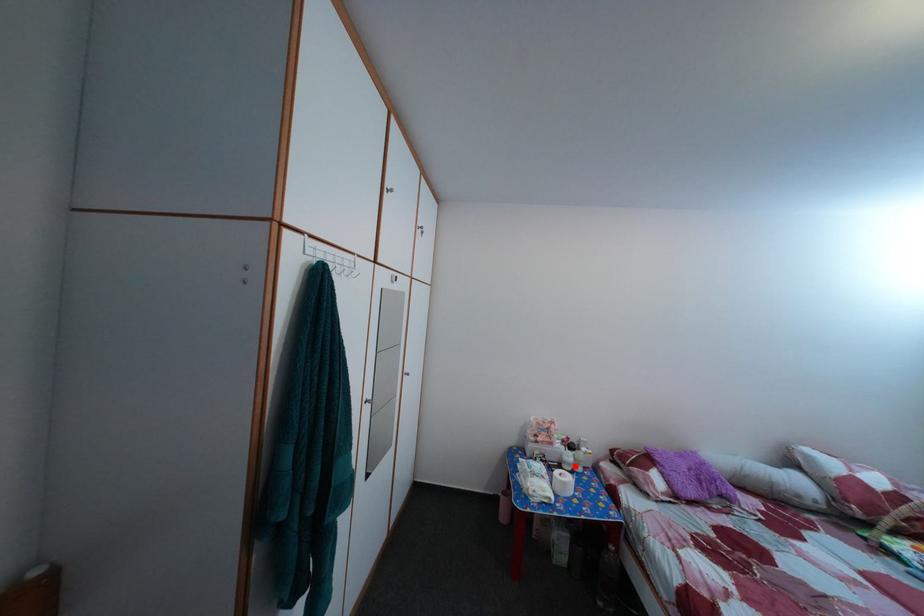
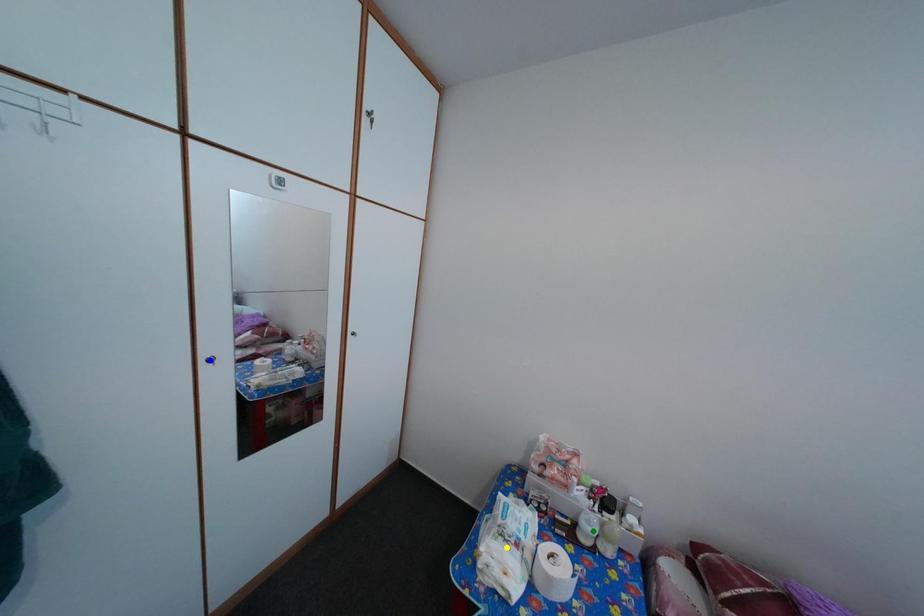
Question: I am providing you with two images of the same scene from different viewpoints. A red point is marked on the first image. You are given multiple points on the second image. Can you choose the point in image 2 that corresponds to the point in image 1?

Choices:
 (A) green point
 (B) blue point
 (C) yellow point

Answer: (A)